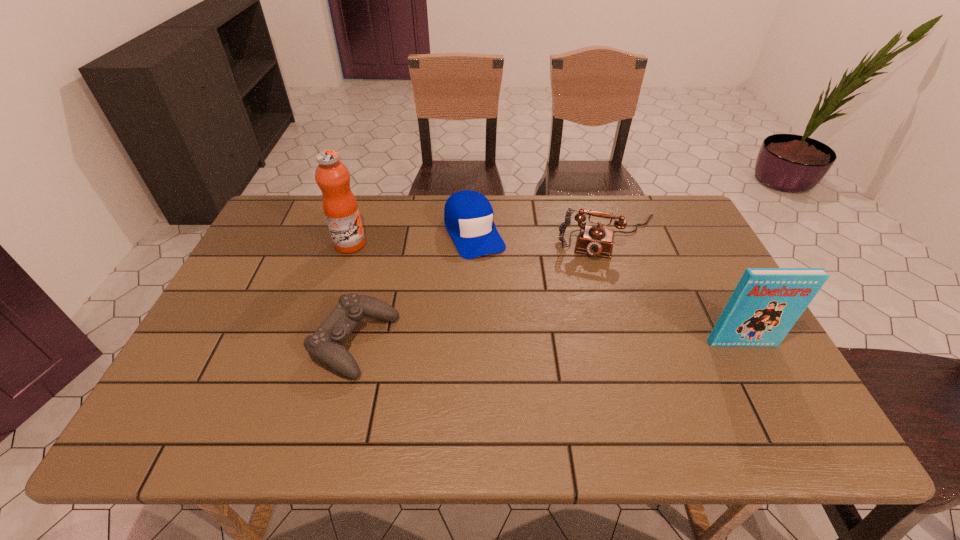
I want to click on control, so click(325, 344).

The image size is (960, 540). I want to click on book, so click(x=766, y=303).

Locate an element on the screen. telephone is located at coordinates (595, 240).

At what (x,y) coordinates should I click in order to perform the action: click on fruit juice. Please return your answer as a coordinate pair (x, y). This screenshot has height=540, width=960. Looking at the image, I should click on (340, 206).

At what (x,y) coordinates should I click in order to perform the action: click on the third object from left to right. Please return your answer as a coordinate pair (x, y). Image resolution: width=960 pixels, height=540 pixels. Looking at the image, I should click on (468, 215).

Where is `baseball cap`? The image size is (960, 540). baseball cap is located at coordinates (468, 215).

The width and height of the screenshot is (960, 540). In order to click on vacant space situated on the right of the control in this screenshot , I will do (420, 342).

At what (x,y) coordinates should I click in order to perform the action: click on vacant space located 0.100m on the front cover of the book. Please return your answer as a coordinate pair (x, y). The image size is (960, 540). Looking at the image, I should click on (763, 383).

The image size is (960, 540). What are the coordinates of `vacant area situated 0.340m on the dial of the telephone` in the screenshot? It's located at (590, 353).

I want to click on vacant space located on the dial of the telephone, so click(600, 275).